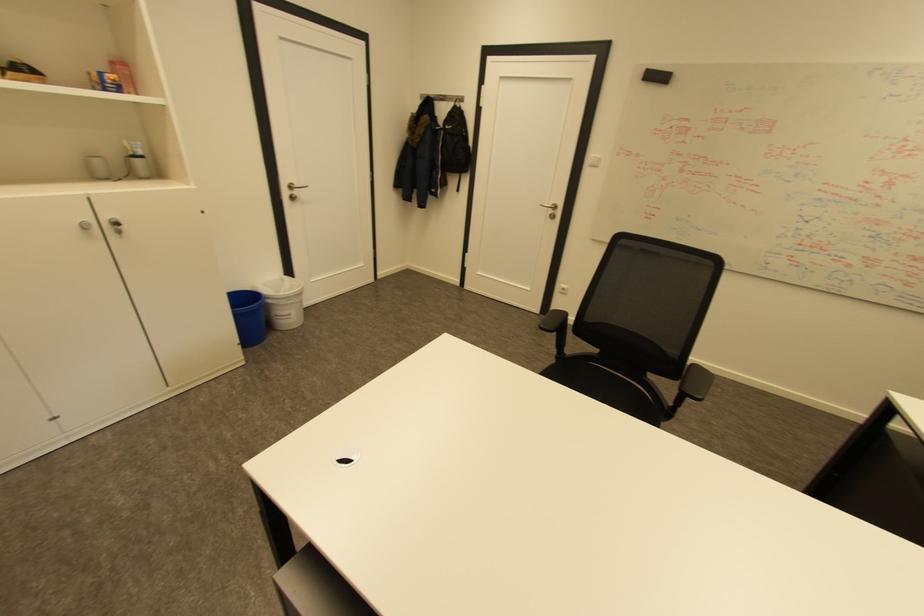
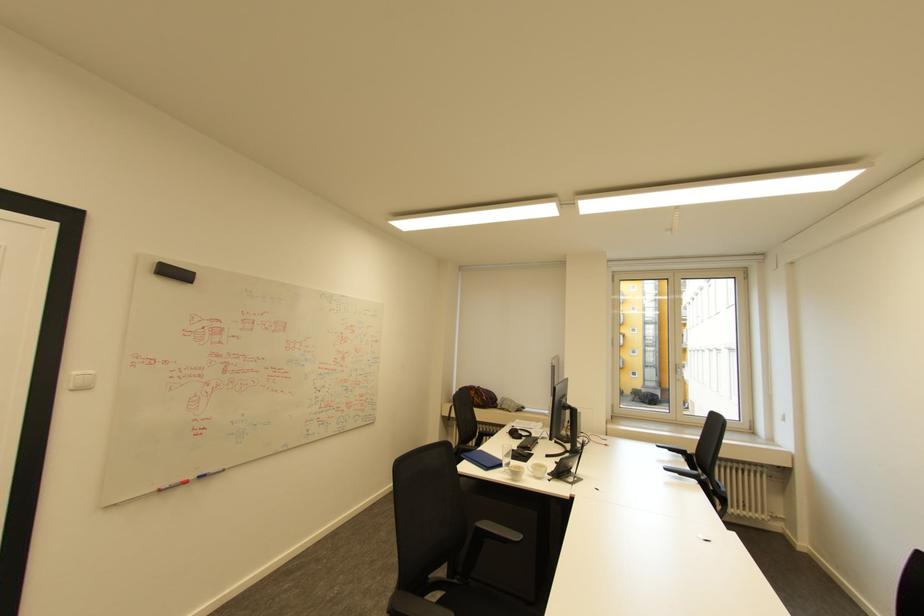
Find the pixel in the second image that matches (600,155) in the first image.

(79, 371)